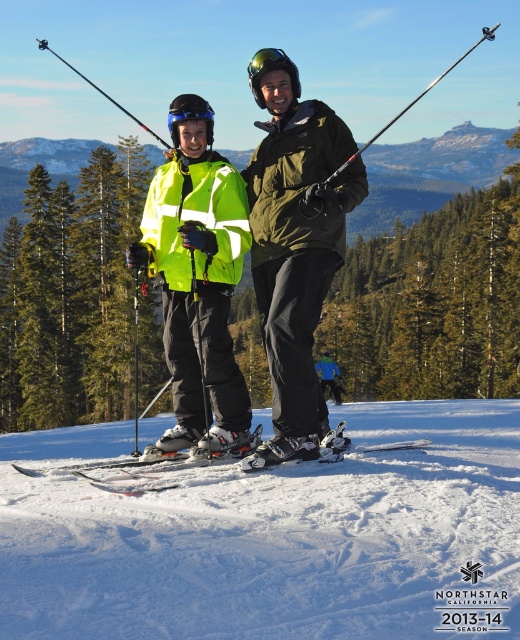
Question: Can you confirm if blue reflective lens at upper center is bigger than blue fabric jacket at center?

Choices:
 (A) yes
 (B) no

Answer: (B)

Question: Is white snow at center above blue reflective lens at upper center?

Choices:
 (A) yes
 (B) no

Answer: (B)

Question: Does blue reflective lens at upper center lie behind blue fabric jacket at center?

Choices:
 (A) no
 (B) yes

Answer: (A)

Question: Which is nearer to the blue reflective lens at upper center?

Choices:
 (A) high visibility yellow jacket at center
 (B) white matte skis at center

Answer: (A)

Question: Which object is positioned closest to the white matte skis at center?

Choices:
 (A) white snow at center
 (B) blue fabric jacket at center
 (C) blue reflective lens at upper center

Answer: (C)

Question: Which point appears closest to the camera in this image?

Choices:
 (A) (306, 106)
 (B) (516, 618)
 (C) (336, 397)

Answer: (B)